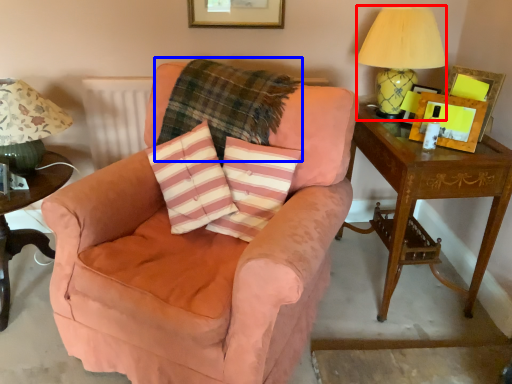
Question: Among these objects, which one is farthest to the camera, table lamp (highlighted by a red box) or plaid (highlighted by a blue box)?

Choices:
 (A) table lamp
 (B) plaid

Answer: (A)